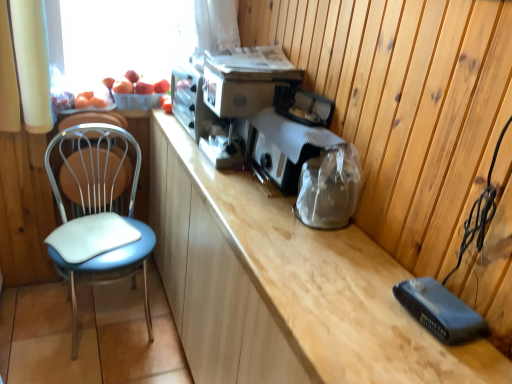
Question: Does metallic silver toaster at center, which is counted as the first appliance, starting from the back, have a greater height compared to matte black toaster at center, the 2th appliance in the back-to-front sequence?

Choices:
 (A) yes
 (B) no

Answer: (A)

Question: From the image's perspective, is metallic silver toaster at center, which is counted as the first appliance, starting from the back, on matte black toaster at center, the 2th appliance in the back-to-front sequence?

Choices:
 (A) no
 (B) yes

Answer: (B)

Question: Is matte black toaster at center, which is counted as the first appliance, starting from the front, at the back of metallic silver toaster at center, the second appliance positioned from the front?

Choices:
 (A) no
 (B) yes

Answer: (A)

Question: Would you say metallic silver toaster at center, the second appliance positioned from the front, is outside matte black toaster at center, which is counted as the first appliance, starting from the front?

Choices:
 (A) no
 (B) yes

Answer: (B)

Question: Would you say matte black toaster at center, the 2th appliance in the back-to-front sequence, is part of metallic silver toaster at center, which is counted as the first appliance, starting from the back,'s contents?

Choices:
 (A) no
 (B) yes

Answer: (A)

Question: Could you tell me if metallic silver toaster at center, which is counted as the first appliance, starting from the back, is turned towards matte black toaster at center, which is counted as the first appliance, starting from the front?

Choices:
 (A) no
 (B) yes

Answer: (A)

Question: Are blue leatherette chair at left and wooden cabinet at center far apart?

Choices:
 (A) no
 (B) yes

Answer: (A)

Question: Is blue leatherette chair at left further to camera compared to wooden cabinet at center?

Choices:
 (A) no
 (B) yes

Answer: (B)

Question: Does blue leatherette chair at left have a larger size compared to wooden cabinet at center?

Choices:
 (A) no
 (B) yes

Answer: (A)

Question: Is blue leatherette chair at left taller than wooden cabinet at center?

Choices:
 (A) no
 (B) yes

Answer: (A)

Question: Can we say blue leatherette chair at left lies outside wooden cabinet at center?

Choices:
 (A) no
 (B) yes

Answer: (B)

Question: Is blue leatherette chair at left closer to camera compared to wooden cabinet at center?

Choices:
 (A) no
 (B) yes

Answer: (A)

Question: Is metallic silver toaster at center, which is counted as the first appliance, starting from the back, at the right side of wooden cabinet at center?

Choices:
 (A) no
 (B) yes

Answer: (B)